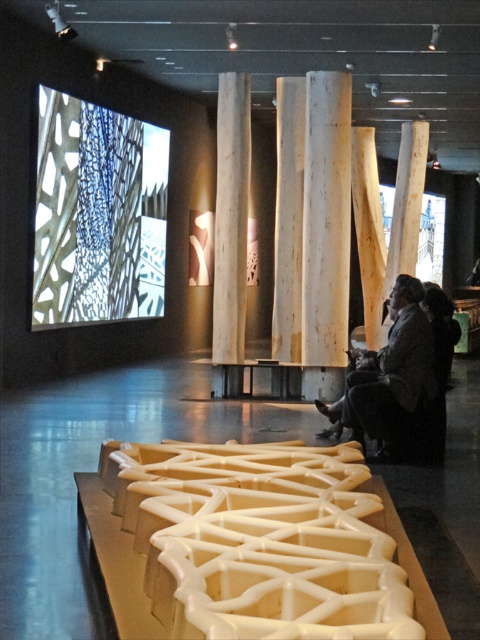
Consider the image. Does dark gray fabric at lower right appear over natural wood pillar at center?

No.

Can you confirm if dark gray fabric at lower right is positioned below natural wood pillar at center?

Yes, dark gray fabric at lower right is below natural wood pillar at center.

Does point (387, 339) come farther from viewer compared to point (238, 176)?

No, it is in front of (238, 176).

This screenshot has width=480, height=640. I want to click on dark gray fabric at lower right, so pyautogui.click(x=387, y=378).